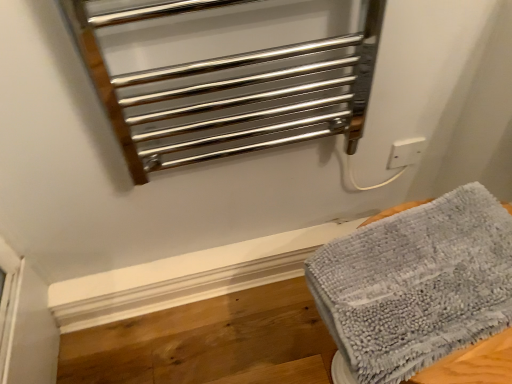
This screenshot has height=384, width=512. I want to click on vacant space underneath polished metal towel rack at upper center (from a real-world perspective), so click(249, 251).